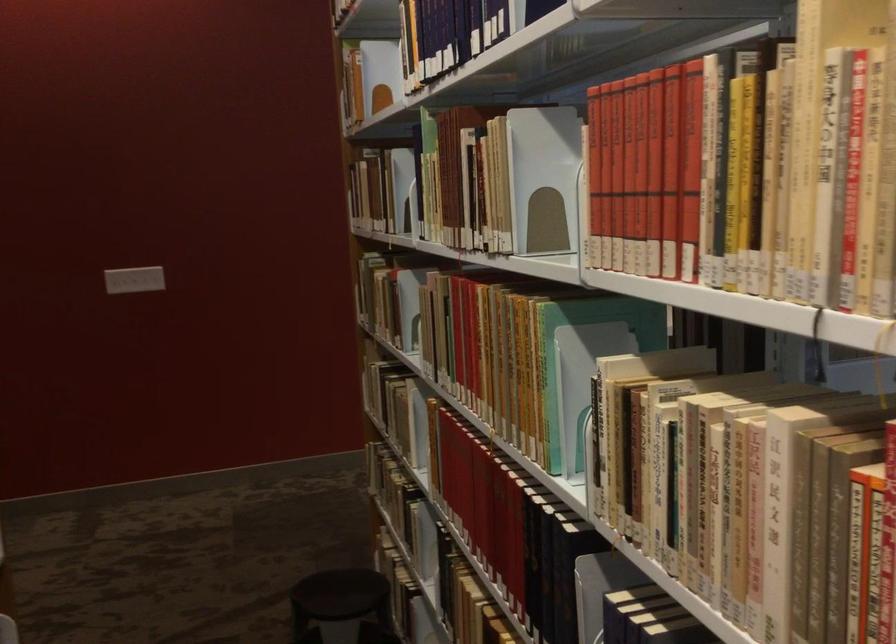
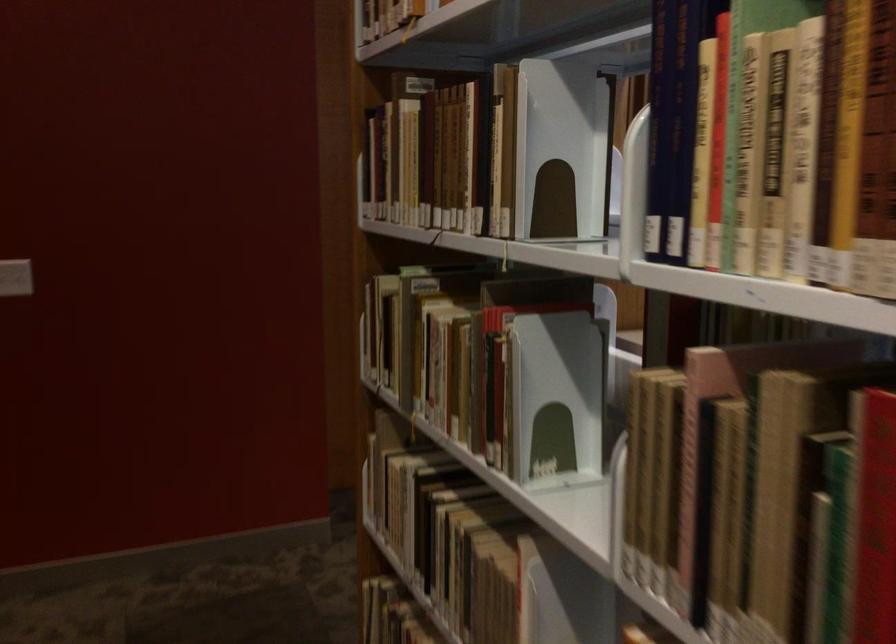
The point at (x=143, y=269) is marked in the first image. Where is the corresponding point in the second image?

(15, 277)